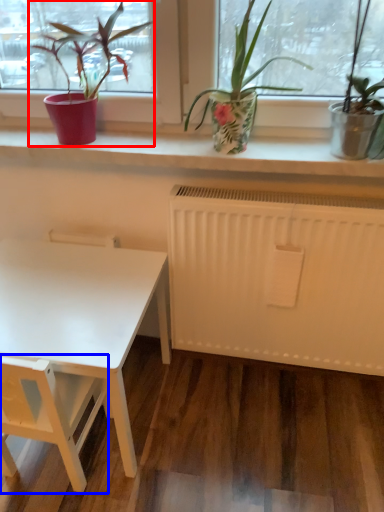
Question: Which point is further to the camera, houseplant (highlighted by a red box) or armchair (highlighted by a blue box)?

Choices:
 (A) houseplant
 (B) armchair

Answer: (A)